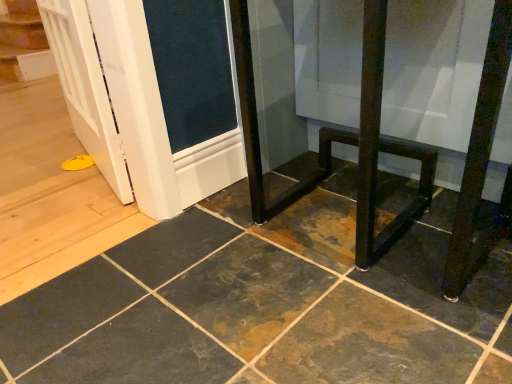
Question: Would you say rustic slate tile at center is inside or outside black metal table at lower right?

Choices:
 (A) outside
 (B) inside

Answer: (A)

Question: Considering the positions of rustic slate tile at center and black metal table at lower right in the image, is rustic slate tile at center bigger or smaller than black metal table at lower right?

Choices:
 (A) big
 (B) small

Answer: (B)

Question: From a real-world perspective, relative to black metal table at lower right, is rustic slate tile at center vertically above or below?

Choices:
 (A) above
 (B) below

Answer: (B)

Question: Is point (461, 213) closer or farther from the camera than point (426, 216)?

Choices:
 (A) farther
 (B) closer

Answer: (B)

Question: From the image's perspective, is black metal table at lower right positioned above or below rustic slate tile at center?

Choices:
 (A) above
 (B) below

Answer: (A)

Question: From a real-world perspective, is black metal table at lower right positioned above or below rustic slate tile at center?

Choices:
 (A) above
 (B) below

Answer: (A)

Question: Is black metal table at lower right taller or shorter than rustic slate tile at center?

Choices:
 (A) tall
 (B) short

Answer: (A)